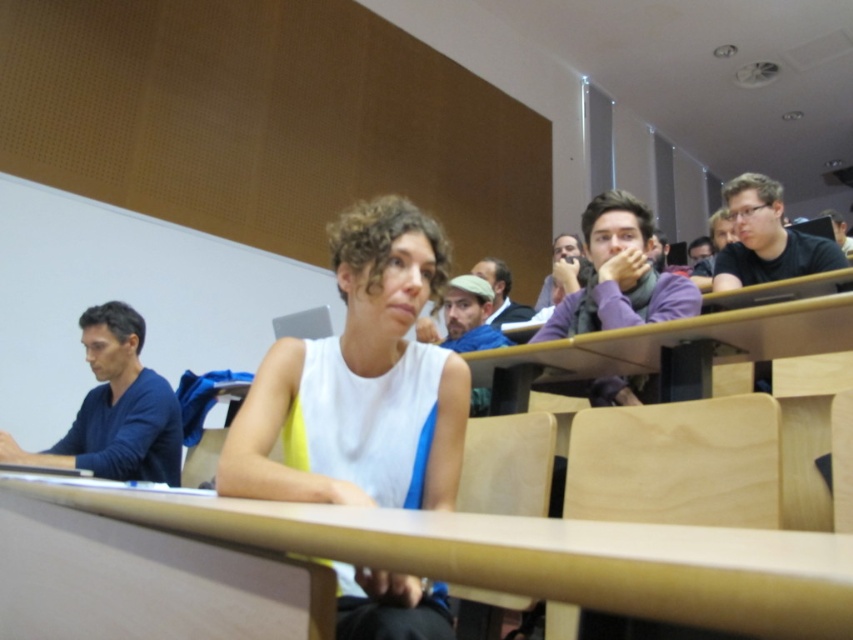
Can you confirm if white matte tank top at center is positioned below wooden table at center?

Actually, white matte tank top at center is above wooden table at center.

Based on the photo, does white matte tank top at center have a greater width compared to wooden table at center?

No, white matte tank top at center is not wider than wooden table at center.

What do you see at coordinates (358, 381) in the screenshot? I see `white matte tank top at center` at bounding box center [358, 381].

Where is `white matte tank top at center`? This screenshot has height=640, width=853. white matte tank top at center is located at coordinates (358, 381).